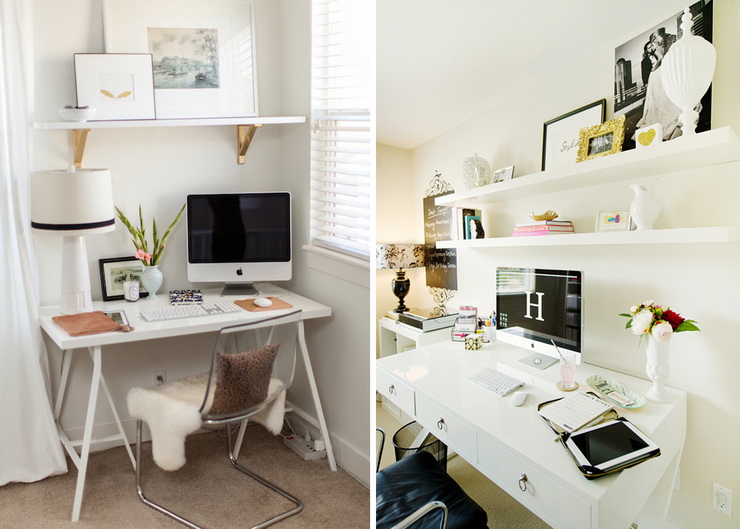
The height and width of the screenshot is (529, 740). What are the coordinates of `keybaord` in the screenshot? It's located at (166, 307), (494, 372).